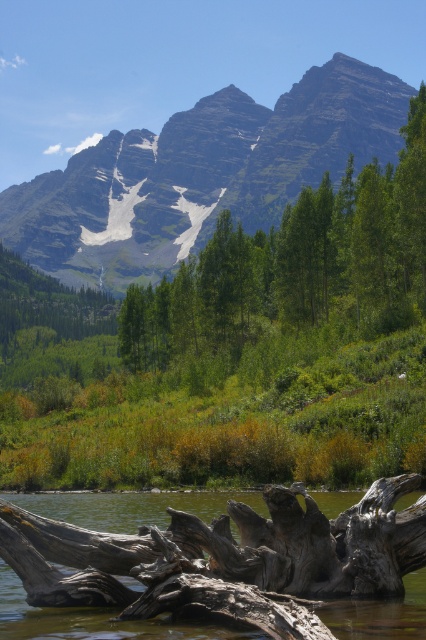
You are a hiker planning to take a photo of the gray wood log at lower center while standing on the green grassy mountain at upper center. Will the log be fully visible in your photo if you point the camera downward?

The green grassy mountain at upper center is taller than the gray wood log at lower center, so when you stand on the green grassy mountain at upper center and point the camera downward, the gray wood log at lower center will be fully visible in your photo.

You are standing in the landscape and want to take a photo. You notice two points marked in the scene. Which point is closer to you, point 1 at coordinates point (154, 230) or point 2 at coordinates point (244, 621)?

Point 2 at coordinates point (244, 621) is closer to you because the description states that point (154, 230) is further to the camera than point (244, 621).